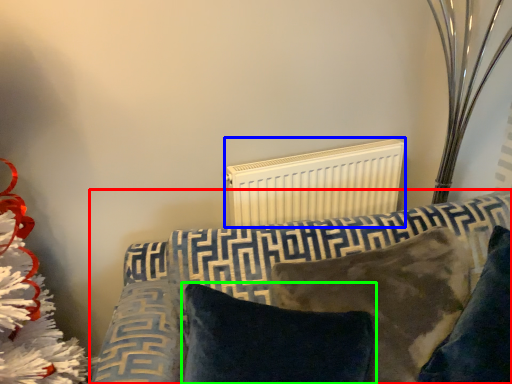
Question: Which object is positioned farthest from furniture (highlighted by a red box)? Select from radiator (highlighted by a blue box) and pillow (highlighted by a green box).

Choices:
 (A) radiator
 (B) pillow

Answer: (A)